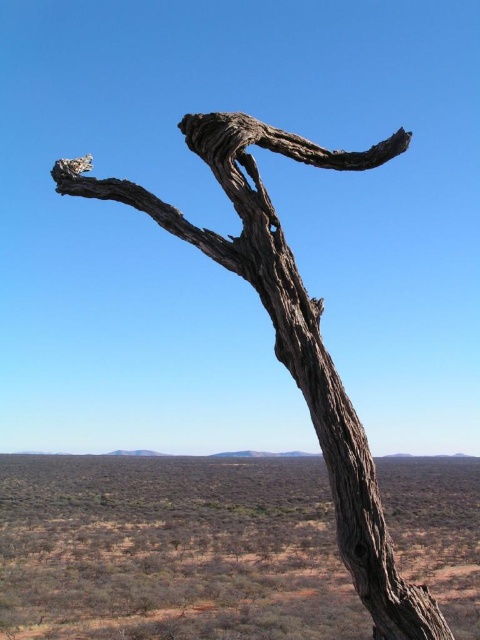
You are a hiker who wants to take a photo of the gray rough bark tree at center. To avoid the brown dry grass at lower left from blocking the view, where should you position yourself relative to the tree?

The brown dry grass at lower left is positioned under the gray rough bark tree at center. To avoid blocking the view, you should position yourself to the right side of the tree so the grass is out of frame.

You are standing at the center of the image and want to place a small marker at the exact location of the brown dry grass at lower left. According to the coordinates provided, where should you place it?

The brown dry grass at lower left should be placed at coordinates point (170, 550) as specified in the description.